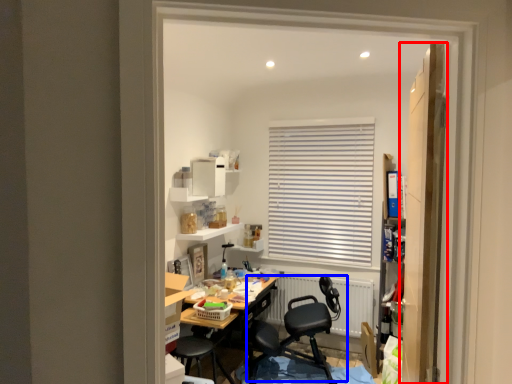
Question: Among these objects, which one is nearest to the camera, door (highlighted by a red box) or chair (highlighted by a blue box)?

Choices:
 (A) door
 (B) chair

Answer: (A)